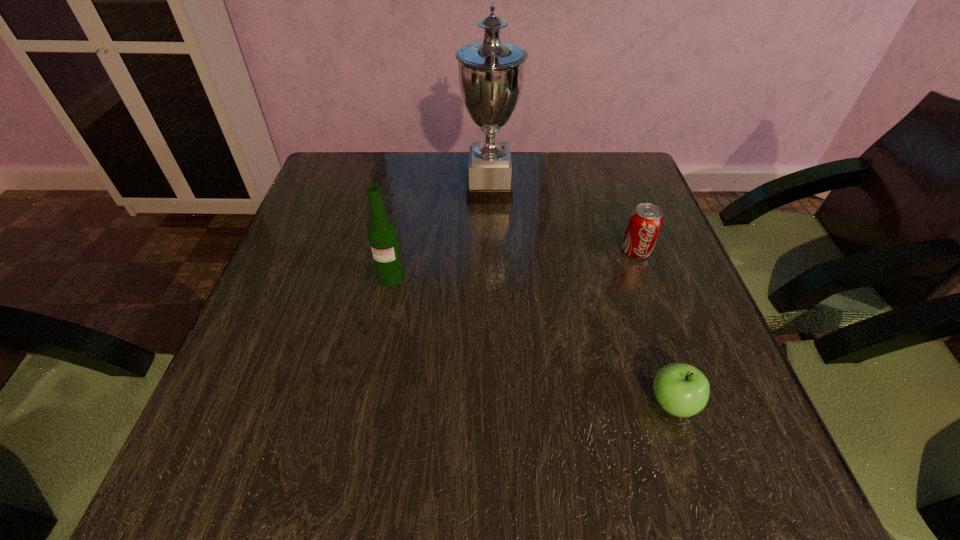
Locate an element on the screen. The width and height of the screenshot is (960, 540). free space located 0.270m at the front view of the second object from left to right is located at coordinates (357, 190).

Locate an element on the screen. vacant space situated 0.120m on the label of the beer bottle is located at coordinates (380, 334).

I want to click on free space located on the back of the second farthest object, so (626, 225).

This screenshot has height=540, width=960. In order to click on free location located on the left of the nearest object in this screenshot , I will do `click(534, 403)`.

Identify the location of object that is at the far edge. This screenshot has width=960, height=540. (491, 73).

Where is `soda that is at the right edge`? This screenshot has height=540, width=960. soda that is at the right edge is located at coordinates (645, 222).

This screenshot has height=540, width=960. Identify the location of apple present at the right edge. (682, 390).

In the image, there is a desktop. Identify the location of free space at the far edge. (396, 199).

Image resolution: width=960 pixels, height=540 pixels. Find the location of `free spot at the near edge of the desktop`. free spot at the near edge of the desktop is located at coordinates (588, 451).

The width and height of the screenshot is (960, 540). In order to click on free space at the left edge of the desktop in this screenshot , I will do `click(299, 220)`.